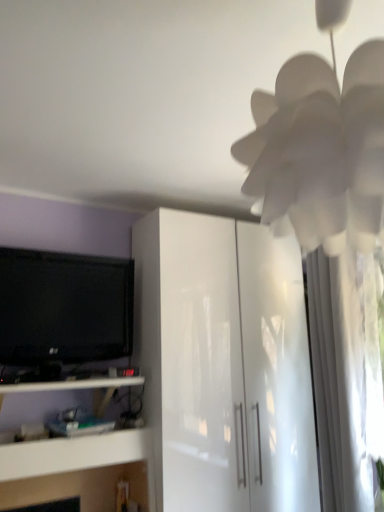
Question: From a real-world perspective, is white glossy shelf at lower left positioned above or below black glossy tv at left?

Choices:
 (A) below
 (B) above

Answer: (A)

Question: In terms of height, does white glossy shelf at lower left look taller or shorter compared to black glossy tv at left?

Choices:
 (A) tall
 (B) short

Answer: (B)

Question: Estimate the real-world distances between objects in this image. Which object is farther from the white paper flower at upper right?

Choices:
 (A) white sheer curtain at right
 (B) black glossy tv at left
 (C) glossy white cabinet at center
 (D) white glossy shelf at lower left

Answer: (D)

Question: Based on their relative distances, which object is nearer to the white sheer curtain at right?

Choices:
 (A) black glossy tv at left
 (B) white glossy shelf at lower left
 (C) white paper flower at upper right
 (D) glossy white cabinet at center

Answer: (D)